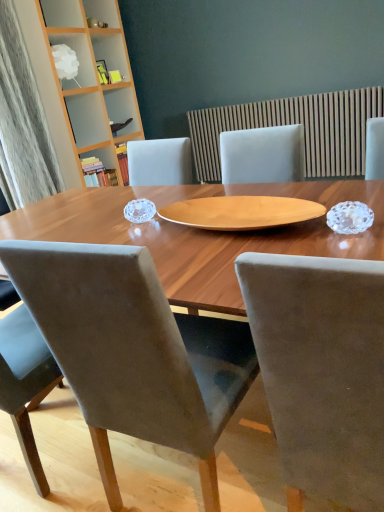
Image resolution: width=384 pixels, height=512 pixels. What do you see at coordinates (79, 56) in the screenshot?
I see `white frosted glass lampshade at upper left, the 1th shelf positioned from the top` at bounding box center [79, 56].

Where is `velvet grey chair at center, the 1th chair viewed from the left`? The image size is (384, 512). velvet grey chair at center, the 1th chair viewed from the left is located at coordinates (134, 351).

From the image's perspective, which is above, velvet grey chair at center, the 1th chair viewed from the left, or wooden bookshelf at upper left, the 1th shelf from the bottom?

From the image's view, wooden bookshelf at upper left, the 1th shelf from the bottom, is above.

From a real-world perspective, is velvet grey chair at center, the 1th chair viewed from the left, above or below wooden bookshelf at upper left, which is the second shelf from top to bottom?

From a real-world perspective, velvet grey chair at center, the 1th chair viewed from the left, is physically below wooden bookshelf at upper left, which is the second shelf from top to bottom.

Can wooden bookshelf at upper left, the 1th shelf from the bottom, be found inside velvet grey chair at center, the 1th chair viewed from the left?

Actually, wooden bookshelf at upper left, the 1th shelf from the bottom, is outside velvet grey chair at center, the 1th chair viewed from the left.

Between velvet grey chair at center, the 1th chair viewed from the left, and wooden slats at upper center, which one has smaller width?

Thinner between the two is wooden slats at upper center.

Considering the positions of objects velvet grey chair at center, positioned as the second chair in right-to-left order, and wooden slats at upper center in the image provided, who is behind, velvet grey chair at center, positioned as the second chair in right-to-left order, or wooden slats at upper center?

wooden slats at upper center is further away from the camera.

Is point (196, 369) positioned in front of point (363, 159)?

Yes, it is.

This screenshot has height=512, width=384. What are the coordinates of `radiator lying on the right of velvet grey chair at center, the 1th chair viewed from the left` in the screenshot? It's located at (292, 124).

Which is more to the left, velvet grey chair at center, positioned as the second chair in right-to-left order, or suede chair at center, the 1th chair when ordered from right to left?

From the viewer's perspective, velvet grey chair at center, positioned as the second chair in right-to-left order, appears more on the left side.

You are a GUI agent. You are given a task and a screenshot of the screen. Output one action in this format:
    pyautogui.click(x=<x>, y=<y>)
    Task: Click on the chair located behind the suede chair at center, the 1th chair when ordered from right to left
    The height and width of the screenshot is (512, 384).
    Given the screenshot: What is the action you would take?
    pyautogui.click(x=134, y=351)

Is velvet grey chair at center, the 1th chair viewed from the left, aimed at suede chair at center, the 1th chair when ordered from right to left?

No, velvet grey chair at center, the 1th chair viewed from the left, is not turned towards suede chair at center, the 1th chair when ordered from right to left.

From the image's perspective, is velvet grey chair at center, the 1th chair viewed from the left, under suede chair at center, marked as the 2th chair in a left-to-right arrangement?

No.

Can you tell me how much suede chair at center, marked as the 2th chair in a left-to-right arrangement, and wooden bookshelf at upper left, which is the second shelf from top to bottom, differ in facing direction?

89.6 degrees.

Is suede chair at center, the 1th chair when ordered from right to left, further to camera compared to wooden bookshelf at upper left, which is the second shelf from top to bottom?

No, suede chair at center, the 1th chair when ordered from right to left, is closer to the camera.

Is suede chair at center, marked as the 2th chair in a left-to-right arrangement, taller or shorter than wooden bookshelf at upper left, which is the second shelf from top to bottom?

suede chair at center, marked as the 2th chair in a left-to-right arrangement, is taller than wooden bookshelf at upper left, which is the second shelf from top to bottom.

Locate an element on the screen. the 1st shelf above the suede chair at center, marked as the 2th chair in a left-to-right arrangement (from the image's perspective) is located at coordinates (100, 168).

Is velvet grey chair at center, positioned as the second chair in right-to-left order, a part of wooden bookshelf at upper left, the 1th shelf from the bottom?

No, velvet grey chair at center, positioned as the second chair in right-to-left order, is not a part of wooden bookshelf at upper left, the 1th shelf from the bottom.

Which of these two, wooden bookshelf at upper left, which is the second shelf from top to bottom, or velvet grey chair at center, the 1th chair viewed from the left, is bigger?

Bigger between the two is velvet grey chair at center, the 1th chair viewed from the left.

From a real-world perspective, is wooden bookshelf at upper left, which is the second shelf from top to bottom, under velvet grey chair at center, positioned as the second chair in right-to-left order?

No.

Is wooden bookshelf at upper left, the 1th shelf from the bottom, at the right side of velvet grey chair at center, the 1th chair viewed from the left?

No, wooden bookshelf at upper left, the 1th shelf from the bottom, is not to the right of velvet grey chair at center, the 1th chair viewed from the left.

Are wooden slats at upper center and wooden bookshelf at upper left, which is the second shelf from top to bottom, located far from each other?

Indeed, wooden slats at upper center is not near wooden bookshelf at upper left, which is the second shelf from top to bottom.

Can you tell me how much wooden slats at upper center and wooden bookshelf at upper left, which is the second shelf from top to bottom, differ in facing direction?

They differ by 92.1 degrees in their facing directions.

Which object is more forward, wooden slats at upper center or wooden bookshelf at upper left, which is the second shelf from top to bottom?

wooden slats at upper center.

Considering the relative sizes of wooden slats at upper center and wooden bookshelf at upper left, which is the second shelf from top to bottom, in the image provided, is wooden slats at upper center shorter than wooden bookshelf at upper left, which is the second shelf from top to bottom,?

No.

Between white frosted glass lampshade at upper left, the 2th shelf in the bottom-to-top sequence, and wooden bookshelf at upper left, the 1th shelf from the bottom, which one has more height?

wooden bookshelf at upper left, the 1th shelf from the bottom, is taller.

Which is closer, [82,62] or [90,167]?

Point [82,62] appears to be closer to the viewer than point [90,167].

Is white frosted glass lampshade at upper left, the 1th shelf positioned from the top, far from wooden bookshelf at upper left, which is the second shelf from top to bottom?

That's not correct — white frosted glass lampshade at upper left, the 1th shelf positioned from the top, is a little close to wooden bookshelf at upper left, which is the second shelf from top to bottom.

From the image's perspective, is white frosted glass lampshade at upper left, the 2th shelf in the bottom-to-top sequence, positioned above or below wooden bookshelf at upper left, the 1th shelf from the bottom?

Clearly, from the image's perspective, white frosted glass lampshade at upper left, the 2th shelf in the bottom-to-top sequence, is above wooden bookshelf at upper left, the 1th shelf from the bottom.

From the velvet grey chair at center, positioned as the second chair in right-to-left order, count 2nd shelfs backward and point to it. Please provide its 2D coordinates.

[(100, 168)]

Identify the location of the 1st chair positioned below the wooden slats at upper center (from the image's perspective). (134, 351).

Based on their spatial positions, is suede chair at center, marked as the 2th chair in a left-to-right arrangement, or wooden bookshelf at upper left, the 1th shelf from the bottom, closer to wooden slats at upper center?

wooden bookshelf at upper left, the 1th shelf from the bottom, is positioned closer to the anchor wooden slats at upper center.

Considering their positions, is white frosted glass lampshade at upper left, the 2th shelf in the bottom-to-top sequence, positioned further to wooden slats at upper center than velvet grey chair at center, the 1th chair viewed from the left?

The object further to wooden slats at upper center is velvet grey chair at center, the 1th chair viewed from the left.

When comparing their distances from suede chair at center, marked as the 2th chair in a left-to-right arrangement, does wooden bookshelf at upper left, which is the second shelf from top to bottom, or wooden slats at upper center seem closer?

The object closer to suede chair at center, marked as the 2th chair in a left-to-right arrangement, is wooden slats at upper center.

From the image, which object appears to be farther from white frosted glass lampshade at upper left, the 1th shelf positioned from the top, suede chair at center, the 1th chair when ordered from right to left, or wooden bookshelf at upper left, which is the second shelf from top to bottom?

Based on the image, suede chair at center, the 1th chair when ordered from right to left, appears to be further to white frosted glass lampshade at upper left, the 1th shelf positioned from the top.

Based on their spatial positions, is wooden bookshelf at upper left, the 1th shelf from the bottom, or velvet grey chair at center, the 1th chair viewed from the left, closer to wooden slats at upper center?

Based on the image, wooden bookshelf at upper left, the 1th shelf from the bottom, appears to be nearer to wooden slats at upper center.

Considering their positions, is velvet grey chair at center, the 1th chair viewed from the left, positioned further to wooden bookshelf at upper left, which is the second shelf from top to bottom, than suede chair at center, the 1th chair when ordered from right to left?

suede chair at center, the 1th chair when ordered from right to left, lies further to wooden bookshelf at upper left, which is the second shelf from top to bottom, than the other object.

Estimate the real-world distances between objects in this image. Which object is further from velvet grey chair at center, the 1th chair viewed from the left, suede chair at center, marked as the 2th chair in a left-to-right arrangement, or wooden bookshelf at upper left, which is the second shelf from top to bottom?

wooden bookshelf at upper left, which is the second shelf from top to bottom.

Which object lies nearer to the anchor point wooden bookshelf at upper left, which is the second shelf from top to bottom, wooden slats at upper center or suede chair at center, the 1th chair when ordered from right to left?

wooden slats at upper center is closer to wooden bookshelf at upper left, which is the second shelf from top to bottom.

Image resolution: width=384 pixels, height=512 pixels. Find the location of `chair located between suede chair at center, marked as the 2th chair in a left-to-right arrangement, and wooden slats at upper center in the depth direction`. chair located between suede chair at center, marked as the 2th chair in a left-to-right arrangement, and wooden slats at upper center in the depth direction is located at coordinates (134, 351).

Where is `radiator positioned between velvet grey chair at center, the 1th chair viewed from the left, and white frosted glass lampshade at upper left, the 1th shelf positioned from the top, from near to far`? radiator positioned between velvet grey chair at center, the 1th chair viewed from the left, and white frosted glass lampshade at upper left, the 1th shelf positioned from the top, from near to far is located at coordinates point(292,124).

Image resolution: width=384 pixels, height=512 pixels. I want to click on shelf between suede chair at center, the 1th chair when ordered from right to left, and wooden bookshelf at upper left, the 1th shelf from the bottom, in the front-back direction, so click(79, 56).

Identify the location of chair between suede chair at center, marked as the 2th chair in a left-to-right arrangement, and wooden bookshelf at upper left, which is the second shelf from top to bottom, from front to back. The width and height of the screenshot is (384, 512). (134, 351).